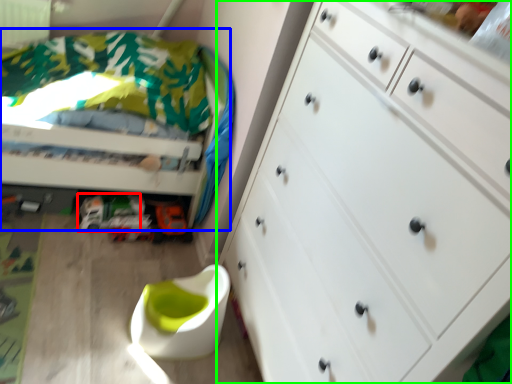
Question: Which is farther away from toy car (highlighted by a red box)? bed (highlighted by a blue box) or chest of drawers (highlighted by a green box)?

Choices:
 (A) bed
 (B) chest of drawers

Answer: (B)